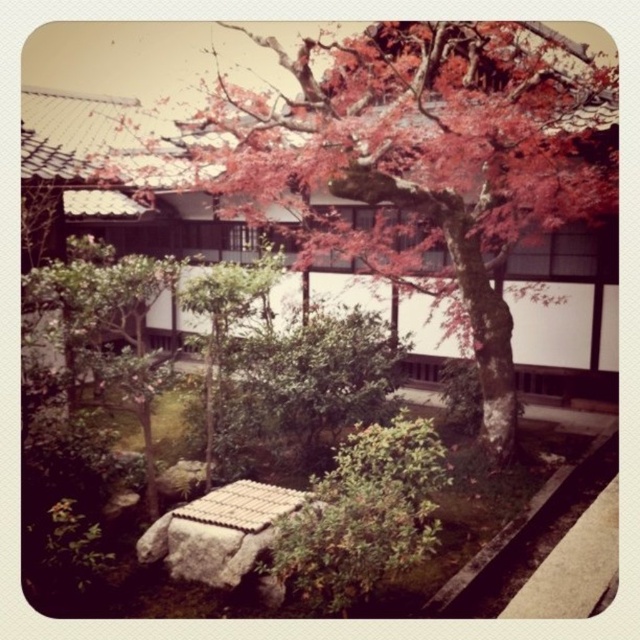
Is green leafy bush at lower left to the left of green leafy bush at center from the viewer's perspective?

Yes, green leafy bush at lower left is to the left of green leafy bush at center.

This screenshot has height=640, width=640. I want to click on green leafy bush at lower left, so click(x=109, y=328).

Identify the location of green leafy bush at lower left. point(109,328).

Does smooth bark tree at center have a larger size compared to green leafy bush at lower left?

No.

Based on the photo, which of these two, smooth bark tree at center or green leafy bush at lower left, stands shorter?

Standing shorter between the two is smooth bark tree at center.

Is point (448, 56) positioned behind point (109, 273)?

Yes, point (448, 56) is farther from viewer.

I want to click on smooth bark tree at center, so click(420, 163).

Which of these two, smooth bark tree at center or green leafy bush at center, stands taller?

green leafy bush at center is taller.

Can you confirm if smooth bark tree at center is smaller than green leafy bush at center?

Yes, smooth bark tree at center is smaller than green leafy bush at center.

What do you see at coordinates (420, 163) in the screenshot? I see `smooth bark tree at center` at bounding box center [420, 163].

What are the coordinates of `smooth bark tree at center` in the screenshot? It's located at (420, 163).